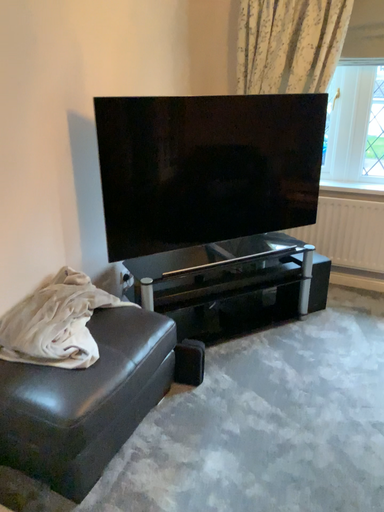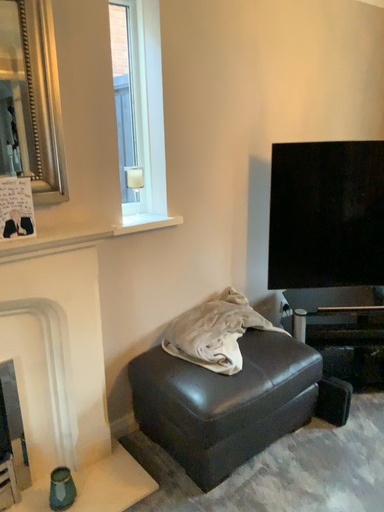
Question: Which way did the camera rotate in the video?

Choices:
 (A) rotated right
 (B) rotated left

Answer: (B)